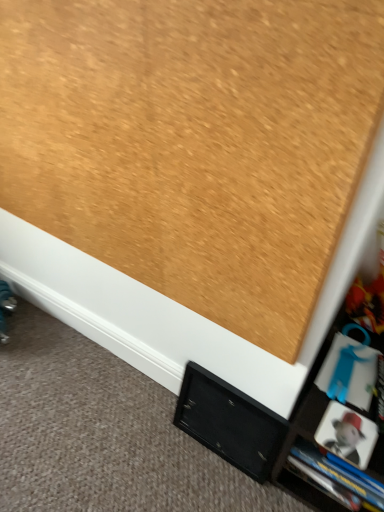
What do you see at coordinates (229, 422) in the screenshot?
I see `black matte cabinet at lower center` at bounding box center [229, 422].

Locate an element on the screen. This screenshot has width=384, height=512. black matte cabinet at lower center is located at coordinates (229, 422).

Is matte black cabinet at lower right far from black matte cabinet at lower center?

That's not correct — matte black cabinet at lower right is a little close to black matte cabinet at lower center.

In terms of width, does matte black cabinet at lower right look wider or thinner when compared to black matte cabinet at lower center?

Clearly, matte black cabinet at lower right has more width compared to black matte cabinet at lower center.

Is matte black cabinet at lower right oriented away from black matte cabinet at lower center?

No, black matte cabinet at lower center is not at the back of matte black cabinet at lower right.

Locate an element on the screen. cabinet beneath the matte black cabinet at lower right (from a real-world perspective) is located at coordinates (229, 422).

Between black matte cabinet at lower center and matte black cabinet at lower right, which one has smaller size?

With smaller size is matte black cabinet at lower right.

Who is taller, black matte cabinet at lower center or matte black cabinet at lower right?

black matte cabinet at lower center is taller.

Which is nearer, (227, 438) or (297, 440)?

Point (227, 438) is farther from the camera than point (297, 440).

Between black matte cabinet at lower center and matte black cabinet at lower right, which one is positioned in front?

matte black cabinet at lower right is closer to the camera.

From a real-world perspective, does matte black cabinet at lower right sit lower than blue plastic book at lower right?

Correct, in the physical world, matte black cabinet at lower right is lower than blue plastic book at lower right.

From the image's perspective, is matte black cabinet at lower right on blue plastic book at lower right?

→ No.

In the image, is matte black cabinet at lower right on the left side or the right side of blue plastic book at lower right?

matte black cabinet at lower right is to the right of blue plastic book at lower right.

This screenshot has width=384, height=512. I want to click on book on the left side of matte black cabinet at lower right, so click(x=349, y=372).

Does blue plastic book at lower right have a greater height compared to black matte cabinet at lower center?

Incorrect, the height of blue plastic book at lower right is not larger of that of black matte cabinet at lower center.

Is black matte cabinet at lower center at the back of blue plastic book at lower right?

No.

Consider the image. From a real-world perspective, is blue plastic book at lower right positioned above or below black matte cabinet at lower center?

blue plastic book at lower right is above black matte cabinet at lower center.

From the image's perspective, is blue plastic book at lower right on black matte cabinet at lower center?

Yes, from the image's perspective, blue plastic book at lower right is above black matte cabinet at lower center.

Who is more distant, black matte cabinet at lower center or blue plastic book at lower right?

black matte cabinet at lower center is behind.

From a real-world perspective, is black matte cabinet at lower center above or below blue plastic book at lower right?

black matte cabinet at lower center is situated lower than blue plastic book at lower right in the real world.

Considering the relative sizes of black matte cabinet at lower center and blue plastic book at lower right in the image provided, is black matte cabinet at lower center shorter than blue plastic book at lower right?

No, black matte cabinet at lower center is not shorter than blue plastic book at lower right.

Is black matte cabinet at lower center completely or partially outside of blue plastic book at lower right?

Yes.

How much distance is there between blue plastic book at lower right and matte black cabinet at lower right?

blue plastic book at lower right and matte black cabinet at lower right are 4.37 inches apart from each other.

Is blue plastic book at lower right turned away from matte black cabinet at lower right?

blue plastic book at lower right does not have its back to matte black cabinet at lower right.

How different are the orientations of blue plastic book at lower right and matte black cabinet at lower right in degrees?

0.424 degrees.

Relative to matte black cabinet at lower right, is blue plastic book at lower right in front or behind?

blue plastic book at lower right is positioned farther from the viewer than matte black cabinet at lower right.

Identify the location of tv cabinet that is in front of the black matte cabinet at lower center. The height and width of the screenshot is (512, 384). (342, 413).

The image size is (384, 512). I want to click on cabinet below the matte black cabinet at lower right (from the image's perspective), so click(x=229, y=422).

Considering their positions, is blue plastic book at lower right positioned closer to matte black cabinet at lower right than black matte cabinet at lower center?

Among the two, blue plastic book at lower right is located nearer to matte black cabinet at lower right.

Considering their positions, is blue plastic book at lower right positioned further to black matte cabinet at lower center than matte black cabinet at lower right?

blue plastic book at lower right.

Estimate the real-world distances between objects in this image. Which object is further from blue plastic book at lower right, matte black cabinet at lower right or black matte cabinet at lower center?

Based on the image, black matte cabinet at lower center appears to be further to blue plastic book at lower right.

Considering their positions, is matte black cabinet at lower right positioned further to black matte cabinet at lower center than blue plastic book at lower right?

Among the two, blue plastic book at lower right is located further to black matte cabinet at lower center.

From the image, which object appears to be nearer to matte black cabinet at lower right, black matte cabinet at lower center or blue plastic book at lower right?

The object closer to matte black cabinet at lower right is blue plastic book at lower right.

When comparing their distances from blue plastic book at lower right, does black matte cabinet at lower center or matte black cabinet at lower right seem closer?

matte black cabinet at lower right is positioned closer to the anchor blue plastic book at lower right.

At what (x,y) coordinates should I click in order to perform the action: click on book between black matte cabinet at lower center and matte black cabinet at lower right from left to right. Please return your answer as a coordinate pair (x, y). This screenshot has height=512, width=384. Looking at the image, I should click on (349, 372).